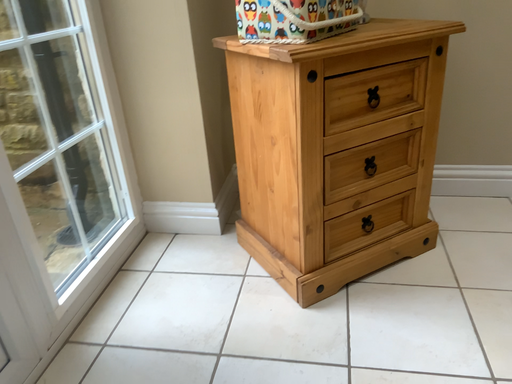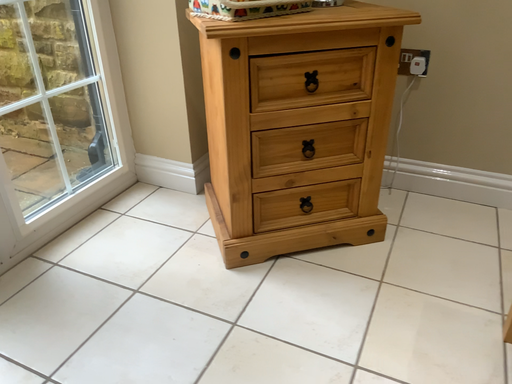
Question: How did the camera likely rotate when shooting the video?

Choices:
 (A) rotated right
 (B) rotated left

Answer: (B)